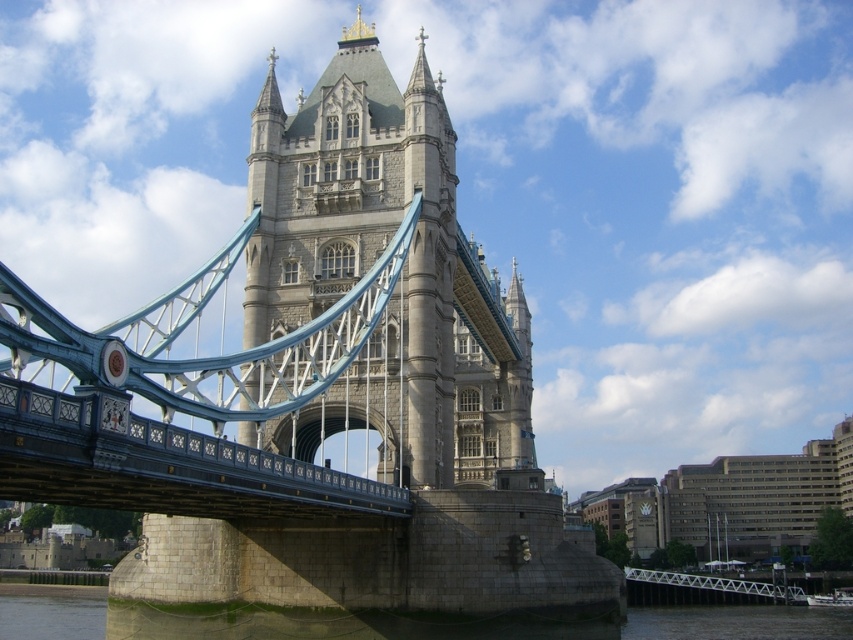
Is gray stone tower at center above white metallic bridge at lower right?

Yes.

Can you confirm if gray stone tower at center is positioned to the right of white metallic bridge at lower right?

In fact, gray stone tower at center is to the left of white metallic bridge at lower right.

Identify the location of gray stone tower at center. (399, 273).

Which is more to the right, gray stone tower at center or gray stone river at lower center?

gray stone tower at center

Does gray stone tower at center have a smaller size compared to gray stone river at lower center?

Indeed, gray stone tower at center has a smaller size compared to gray stone river at lower center.

Who is more forward, (490, 435) or (753, 620)?

Point (753, 620) is more forward.

The height and width of the screenshot is (640, 853). Identify the location of gray stone tower at center. (399, 273).

Can you confirm if stone suspension bridge at center is shorter than white metallic bridge at lower right?

In fact, stone suspension bridge at center may be taller than white metallic bridge at lower right.

Is stone suspension bridge at center taller than white metallic bridge at lower right?

Yes.

Does point (525, 413) come behind point (672, 580)?

No, it is in front of (672, 580).

Image resolution: width=853 pixels, height=640 pixels. In order to click on stone suspension bridge at center in this screenshot , I will do `click(312, 385)`.